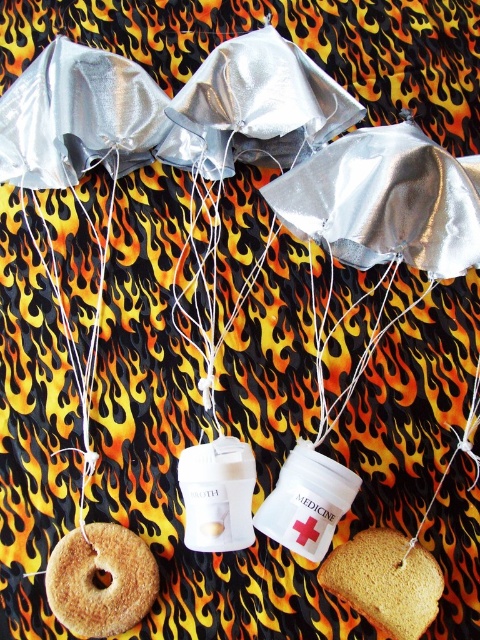
Is golden brown bread at lower right above white string at center?

Actually, golden brown bread at lower right is below white string at center.

The width and height of the screenshot is (480, 640). Identify the location of golden brown bread at lower right. (385, 580).

Who is more distant from viewer, [379,570] or [71,342]?

The point [71,342] is behind.

Identify the location of golden brown bread at lower right. (385, 580).

Between brown crumbly pastry at lower left and white string at center, which one has less height?

Standing shorter between the two is brown crumbly pastry at lower left.

This screenshot has height=640, width=480. Find the location of `brown crumbly pastry at lower left`. brown crumbly pastry at lower left is located at coordinates (100, 579).

Where is `brown crumbly pastry at lower left`? The height and width of the screenshot is (640, 480). brown crumbly pastry at lower left is located at coordinates (100, 579).

Is brown crumbly pastry at lower left behind golden brown bread at lower right?

That is False.

Can you confirm if brown crumbly pastry at lower left is positioned below golden brown bread at lower right?

Yes, brown crumbly pastry at lower left is below golden brown bread at lower right.

Which is behind, point (127, 593) or point (332, 556)?

The point (332, 556) is more distant.

You are a GUI agent. You are given a task and a screenshot of the screen. Output one action in this format:
    pyautogui.click(x=<x>, y=<y>)
    Task: Click on the brown crumbly pastry at lower left
    
    Given the screenshot: What is the action you would take?
    100,579